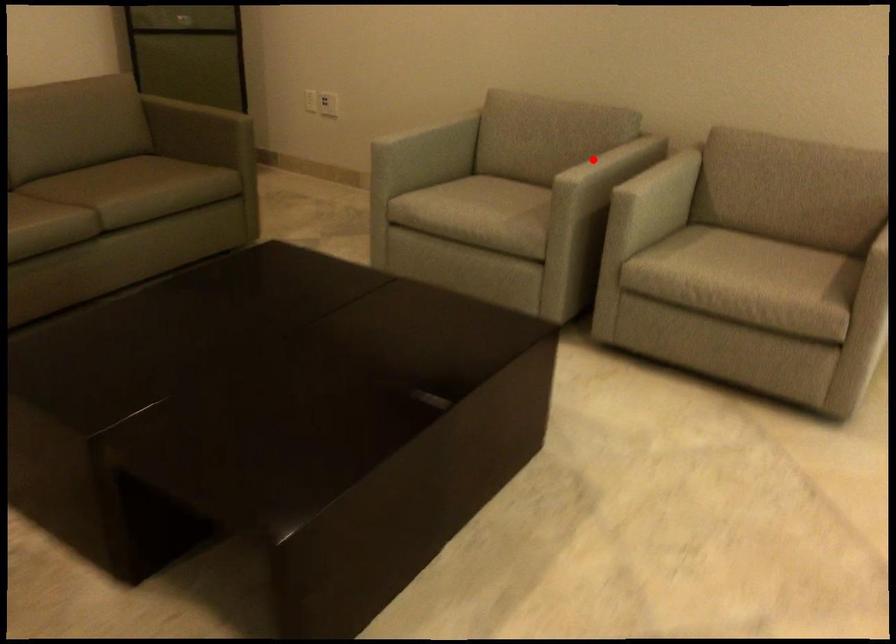
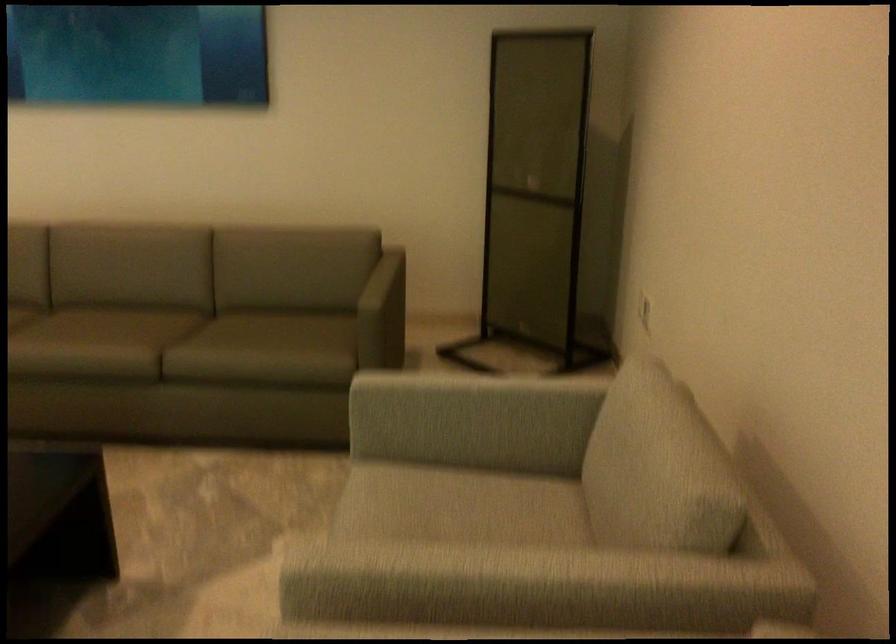
Question: I am providing you with two images of the same scene from different viewpoints. In image1, a red point is highlighted. Considering the same 3D point in image2, which of the following is correct?

Choices:
 (A) It is closer
 (B) It is farther

Answer: (A)